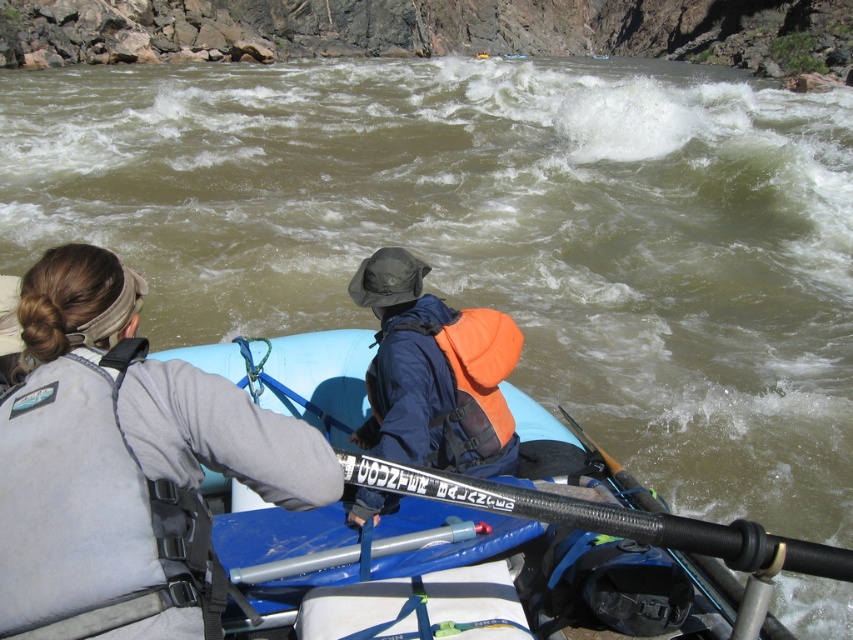
You are a safety inspector checking the rafting gear. You notice a point marked at coordinates (x=125, y=460). What object is located at that point?

The point at coordinates (x=125, y=460) indicates the gray fabric life vest at left.

You are a river rafting guide assessing safety gear. You notice the gray fabric life vest at left and the black textured paddle at center. Which item is positioned higher up in the raft?

The gray fabric life vest at left is much taller than the black textured paddle at center, so the gray fabric life vest at left is positioned higher up in the raft.

You are a river rafting guide assessing the position of the gray fabric life vest at left. What are its coordinates in the image?

The gray fabric life vest at left is located at coordinates point (125, 460).